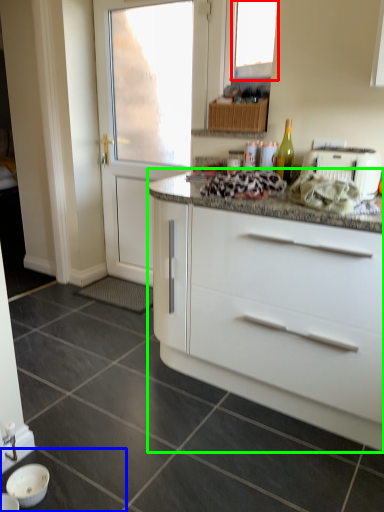
Question: Which is nearer to the window (highlighted by a red box)? tile (highlighted by a blue box) or cabinetry (highlighted by a green box).

Choices:
 (A) tile
 (B) cabinetry

Answer: (B)